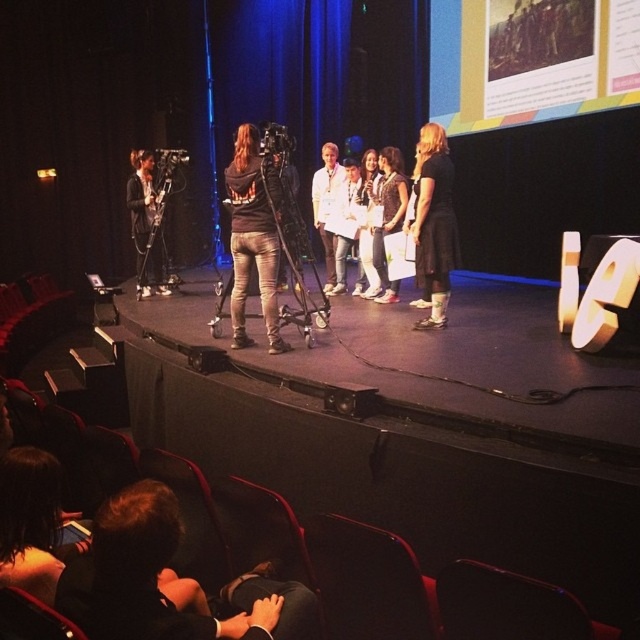
Does black matte dress at center come behind matte black dress at center?

No, it is in front of matte black dress at center.

Who is positioned more to the right, black matte dress at center or matte black dress at center?

black matte dress at center is more to the right.

Where is `black matte dress at center`? black matte dress at center is located at coordinates (435, 221).

Between matte black dress at center and white cotton dress at center, which one appears on the right side from the viewer's perspective?

matte black dress at center

Is point (401, 161) more distant than point (362, 220)?

That is False.

This screenshot has height=640, width=640. Find the location of `matte black dress at center`. matte black dress at center is located at coordinates (388, 216).

You are a GUI agent. You are given a task and a screenshot of the screen. Output one action in this format:
    pyautogui.click(x=<x>, y=<y>)
    Task: Click on the black leather jacket at center
    This screenshot has height=640, width=640.
    Given the screenshot: What is the action you would take?
    pyautogui.click(x=252, y=237)

Is point (257, 195) in front of point (316, 193)?

That is True.

Identify the location of black leather jacket at center. (252, 237).